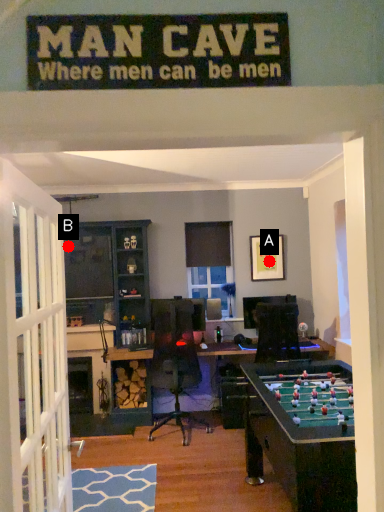
Question: Two points are circled on the image, labeled by A and B beside each circle. Among these points, which one is farthest from the camera?

Choices:
 (A) A is further
 (B) B is further

Answer: (A)